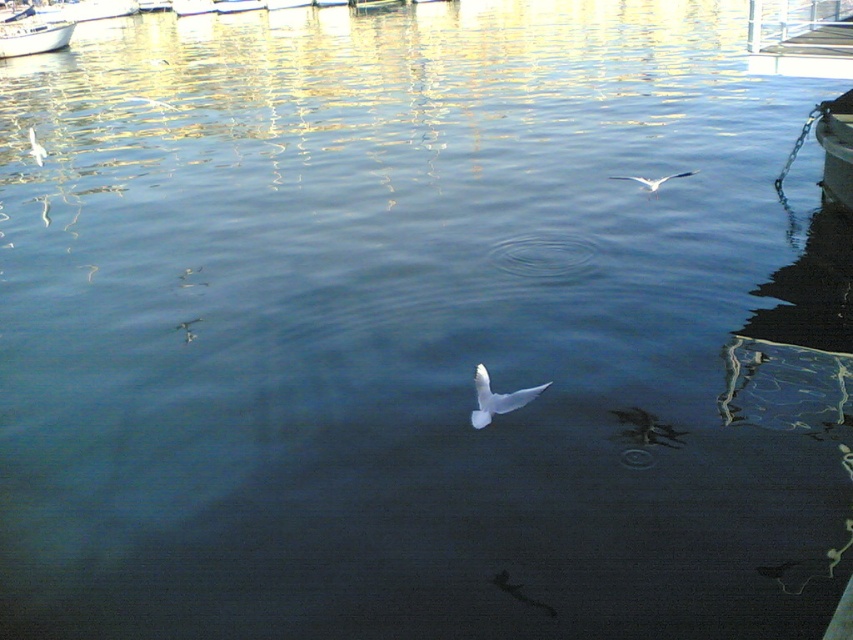
Who is positioned more to the left, metallic silver boat at right or white feathered bird at upper right?

white feathered bird at upper right is more to the left.

Does metallic silver boat at right have a smaller size compared to white feathered bird at upper right?

No, metallic silver boat at right is not smaller than white feathered bird at upper right.

Identify the location of metallic silver boat at right. This screenshot has width=853, height=640. (836, 147).

Which is behind, point (825, 145) or point (485, 392)?

The point (825, 145) is more distant.

This screenshot has width=853, height=640. What do you see at coordinates (836, 147) in the screenshot? I see `metallic silver boat at right` at bounding box center [836, 147].

Locate an element on the screen. Image resolution: width=853 pixels, height=640 pixels. metallic silver boat at right is located at coordinates (836, 147).

You are a GUI agent. You are given a task and a screenshot of the screen. Output one action in this format:
    pyautogui.click(x=<x>, y=<y>)
    Task: Click on the metallic silver boat at right
    The image size is (853, 640).
    Given the screenshot: What is the action you would take?
    pyautogui.click(x=836, y=147)

How much distance is there between white glossy boat at upper left and white matte bird at center?

20.93 meters

Can you confirm if white glossy boat at upper left is shorter than white matte bird at center?

No.

The image size is (853, 640). I want to click on white glossy boat at upper left, so click(33, 36).

Locate an element on the screen. The image size is (853, 640). white glossy boat at upper left is located at coordinates (33, 36).